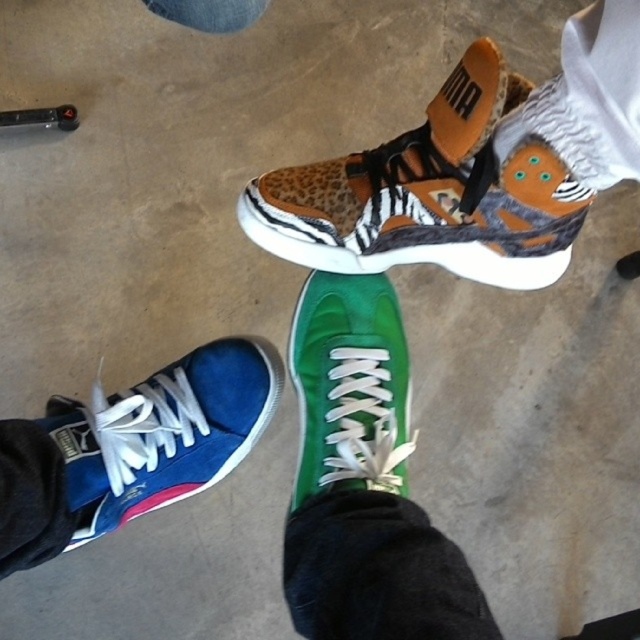
You are a delivery robot that needs to place a small package between the blue suede sneaker at lower left and the green suede sneaker at center. The package is 6 inches long. Can you fit it between them without moving any sneakers?

The blue suede sneaker at lower left is 6.23 inches from the green suede sneaker at center. Since the package is 6 inches long, it can fit between them as there is enough space.

You are trying to match the leopard print fabric sneaker at upper center with its pair. Based on the image, where should you look relative to the green suede sneaker at center?

The leopard print fabric sneaker at upper center is to the right of the green suede sneaker at center, so you should look to the right side of the green suede sneaker at center to find its pair.

You are taking a photo of two points marked on a concrete floor. The first point is at coordinate point[131,472] and the second at point[328,288]. Based on the scene description, which point is closer to the camera?

Point[131,472] is closer to the camera than point[328,288] because it is further to the camera than the other point.